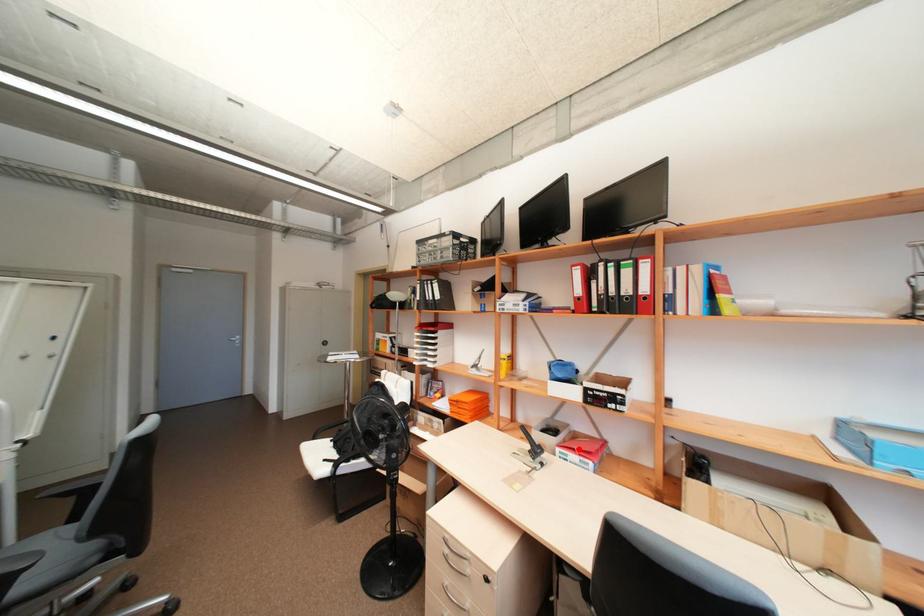
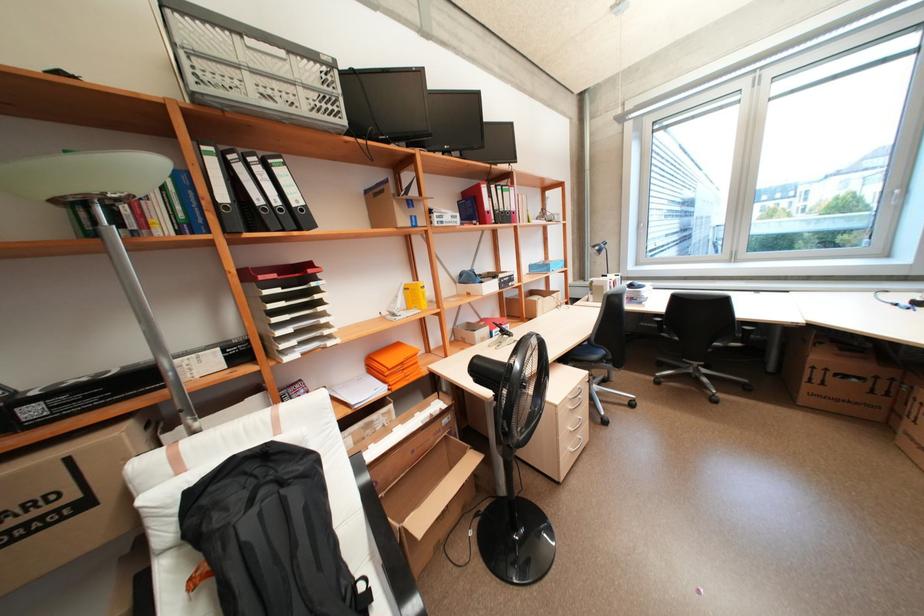
Locate, in the second image, the point that corresponds to the highlighted location in the first image.

(505, 323)